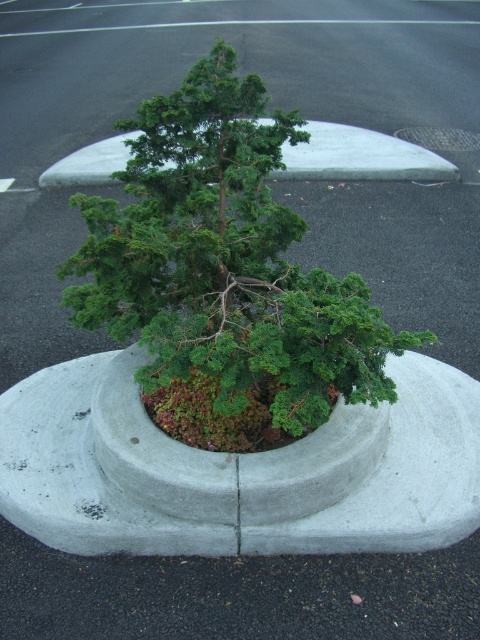
You are standing in a parking lot and see the green matte tree at center and the gray concrete planter at center. Which object is positioned to the left?

The green matte tree at center is positioned to the left of the gray concrete planter at center.

You are standing in the parking lot and see the point marked at coordinates (x=238, y=468). What object is located at that point?

The point at coordinates (x=238, y=468) indicates the gray concrete planter at center.

You are a gardener assessing the health of the green matte tree at center and the concrete at center in the parking lot scene. Based on their positions, which object is more likely to receive direct sunlight first in the morning?

The concrete at center is higher than the green matte tree at center, so the concrete at center will receive direct sunlight first in the morning.